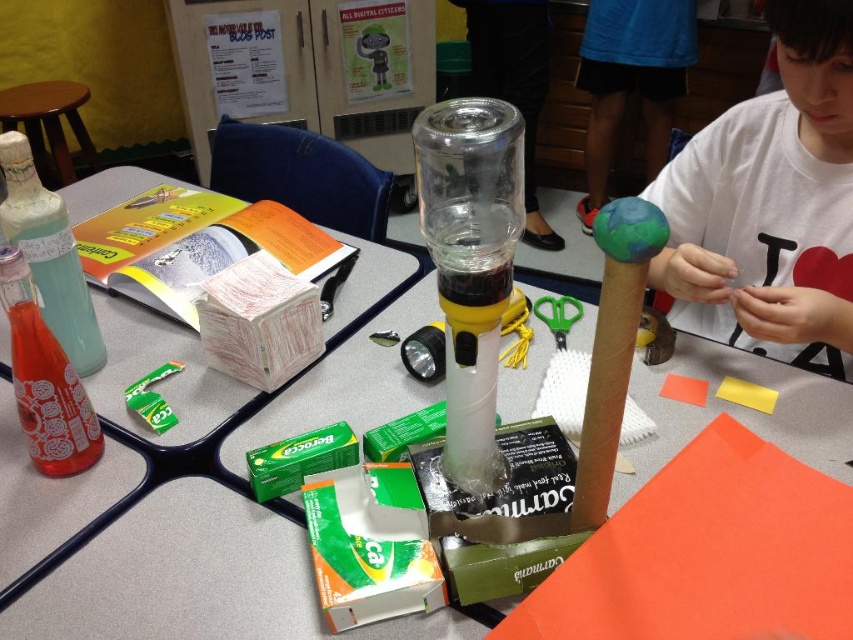
You are a student in the classroom and need to choose between the translucent plastic bottle at center and the matte glass bottle at left for a demonstration. Which bottle is wider?

The translucent plastic bottle at center is wider than the matte glass bottle at left.

You are a student in the classroom and want to grab the translucent plastic bottle at center to adjust its position. Which bottle should you reach for first if you want to avoid knocking over the translucent glass bottle at left?

You should grab the translucent plastic bottle at center first because it is closer to you than the translucent glass bottle at left, so reaching for it first reduces the risk of accidentally knocking over the farther bottle.